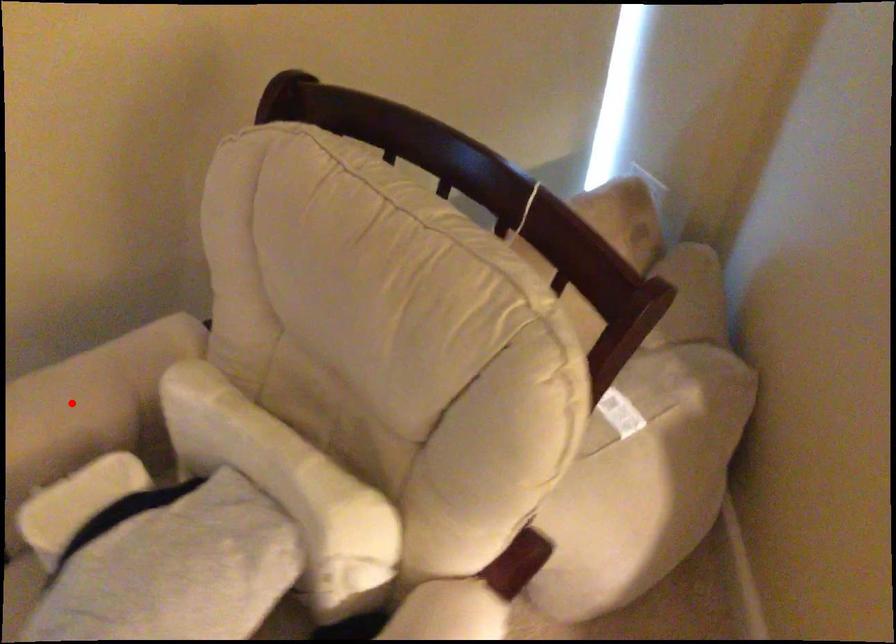
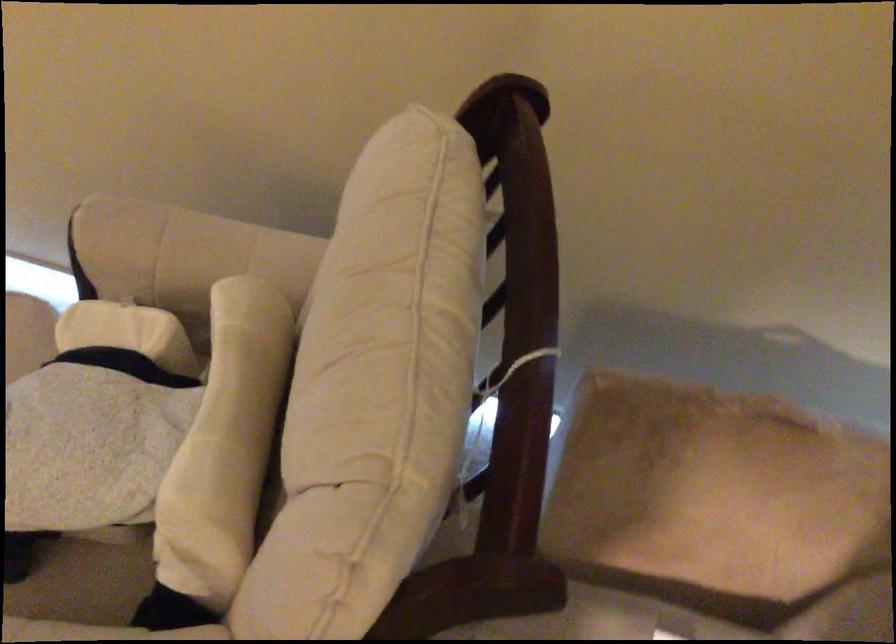
The point at the highlighted location is marked in the first image. Where is the corresponding point in the second image?

(181, 250)